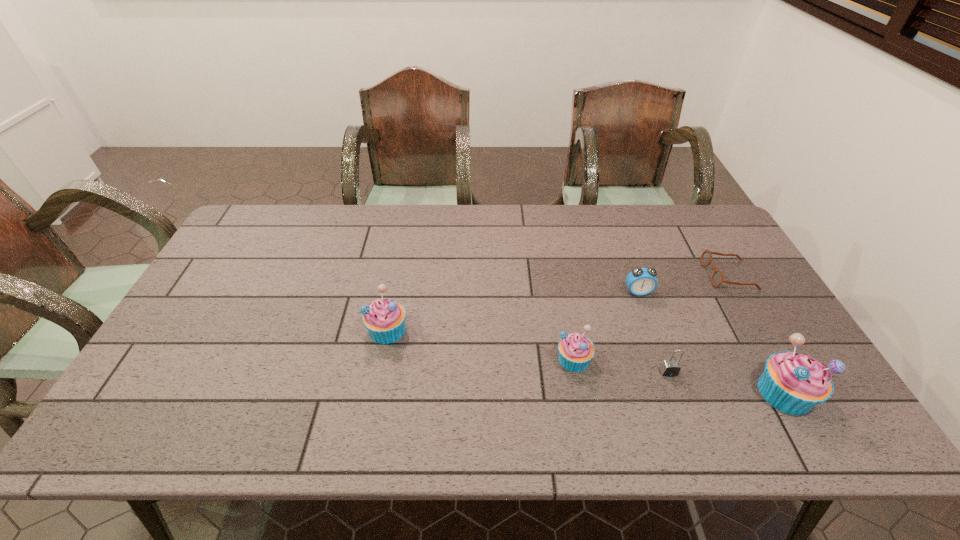
Please point a spot on the left to add another muffin. Please provide its 2D coordinates. Your answer should be formatted as a tuple, i.e. [(x, y)], where the tuple contains the x and y coordinates of a point satisfying the conditions above.

[(222, 303)]